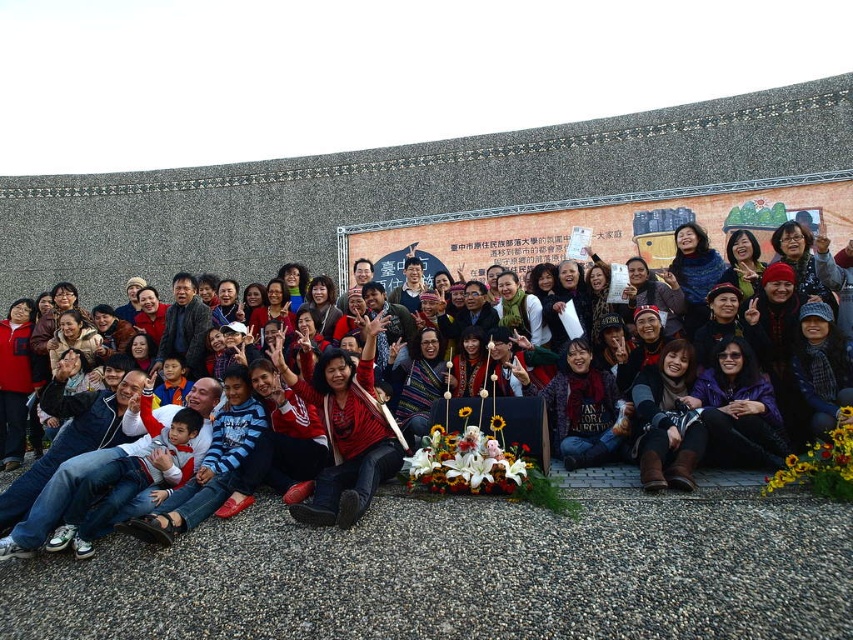
Which is behind, point (820, 460) or point (171, 410)?

Point (171, 410)

Is the position of yellow matte flowers at lower right more distant than that of red sweater at center?

No, it is not.

Describe the element at coordinates (821, 464) in the screenshot. I see `yellow matte flowers at lower right` at that location.

The image size is (853, 640). Find the location of `yellow matte flowers at lower right`. yellow matte flowers at lower right is located at coordinates (821, 464).

Is white silk flowers at center in front of red sweater at center?

That is False.

Can you confirm if white silk flowers at center is positioned below red sweater at center?

Indeed, white silk flowers at center is positioned under red sweater at center.

Which is behind, point (457, 449) or point (61, 376)?

Point (61, 376)

Where is `white silk flowers at center`? white silk flowers at center is located at coordinates (468, 460).

Who is more distant from viewer, (415, 481) or (850, 460)?

The point (415, 481) is more distant.

Does white silk flowers at center have a larger size compared to yellow matte flowers at lower right?

Yes, white silk flowers at center is bigger than yellow matte flowers at lower right.

You are a GUI agent. You are given a task and a screenshot of the screen. Output one action in this format:
    pyautogui.click(x=<x>, y=<y>)
    Task: Click on the white silk flowers at center
    The width and height of the screenshot is (853, 640).
    Given the screenshot: What is the action you would take?
    pyautogui.click(x=468, y=460)